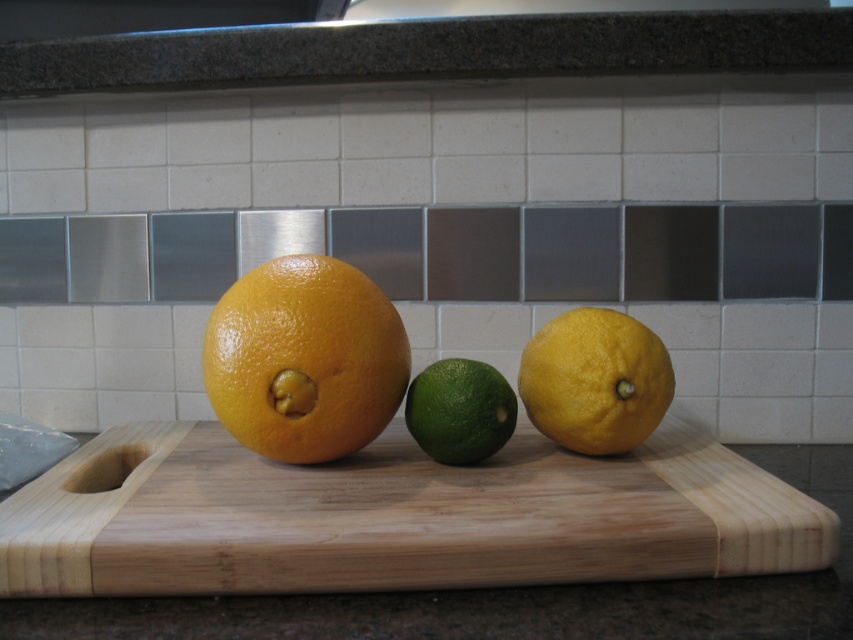
Is orange matte/grainy grapefruit at center smaller than green matte/lacquered lime at center?

No, orange matte/grainy grapefruit at center is not smaller than green matte/lacquered lime at center.

Can you confirm if orange matte/grainy grapefruit at center is positioned above green matte/lacquered lime at center?

Indeed, orange matte/grainy grapefruit at center is positioned over green matte/lacquered lime at center.

At what (x,y) coordinates should I click in order to perform the action: click on orange matte/grainy grapefruit at center. Please return your answer as a coordinate pair (x, y). The height and width of the screenshot is (640, 853). Looking at the image, I should click on (305, 358).

You are a GUI agent. You are given a task and a screenshot of the screen. Output one action in this format:
    pyautogui.click(x=<x>, y=<y>)
    Task: Click on the orange matte/grainy grapefruit at center
    The width and height of the screenshot is (853, 640).
    Given the screenshot: What is the action you would take?
    pyautogui.click(x=305, y=358)

Which of these two, wooden cutting board at center or orange matte/grainy grapefruit at center, stands taller?

With more height is orange matte/grainy grapefruit at center.

Is wooden cutting board at center bigger than orange matte/grainy grapefruit at center?

Yes, wooden cutting board at center is bigger than orange matte/grainy grapefruit at center.

The image size is (853, 640). What do you see at coordinates (395, 516) in the screenshot?
I see `wooden cutting board at center` at bounding box center [395, 516].

This screenshot has height=640, width=853. I want to click on wooden cutting board at center, so click(x=395, y=516).

Who is positioned more to the right, wooden cutting board at center or yellow matte lemon at center?

yellow matte lemon at center is more to the right.

Between point (769, 516) and point (550, 436), which one is positioned behind?

The point (550, 436) is more distant.

Which is behind, point (122, 593) or point (575, 353)?

The point (575, 353) is more distant.

Locate an element on the screen. Image resolution: width=853 pixels, height=640 pixels. wooden cutting board at center is located at coordinates (395, 516).